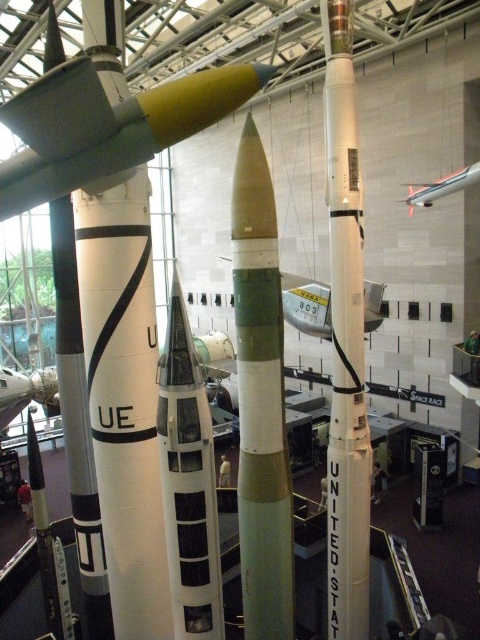
Between point (64, 148) and point (171, 348), which one is positioned in front?

Positioned in front is point (64, 148).

Locate an element on the screen. This screenshot has width=480, height=640. matte green rocket at center is located at coordinates (107, 125).

Based on the photo, is white glossy rocket at center shorter than metallic silver airplane at upper right?

No.

Is white glossy rocket at center wider than metallic silver airplane at upper right?

Yes, white glossy rocket at center is wider than metallic silver airplane at upper right.

What do you see at coordinates (188, 481) in the screenshot? I see `white glossy rocket at center` at bounding box center [188, 481].

Where is `white glossy rocket at center`? white glossy rocket at center is located at coordinates (188, 481).

The height and width of the screenshot is (640, 480). What do you see at coordinates (346, 340) in the screenshot?
I see `white matte rocket at center` at bounding box center [346, 340].

What do you see at coordinates (346, 340) in the screenshot?
I see `white matte rocket at center` at bounding box center [346, 340].

Find the location of `white matte rocket at center`. white matte rocket at center is located at coordinates (346, 340).